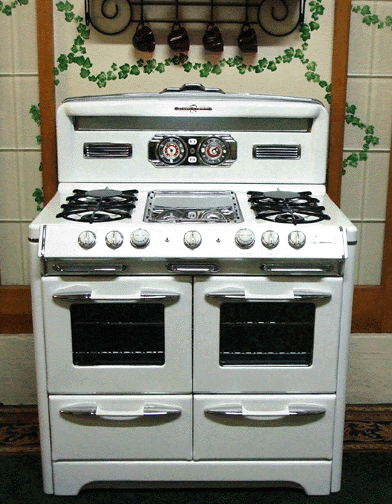
Where is `mug`? mug is located at coordinates (147, 37), (181, 38), (219, 38), (251, 43).